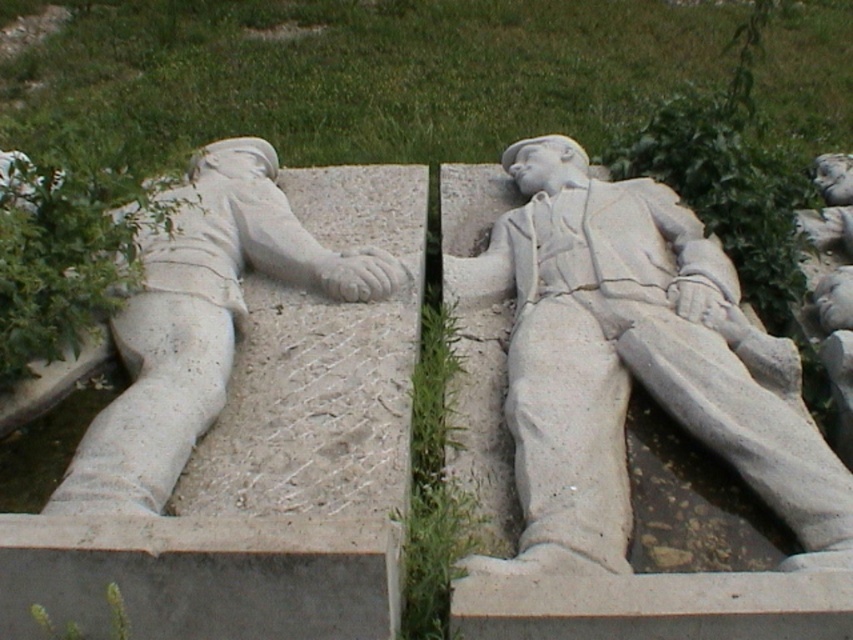
You are standing in front of a memorial with two white stone statues. You want to touch the statue that is closer to you. Which one should you reach for, the white stone statue at center or the white stone statue at left?

Answer: The white stone statue at center is closer to the viewer, so you should reach for the white stone statue at center.

You are standing at the entrance of the memorial and want to place a new flower at the base of the white stone statue at center. Given that the entrance is at point 0,0 and the statue is at coordinates 0.570, 0.744, in which general direction should you walk to reach the statue?

The white stone statue at center is located at coordinates (634, 364). Since the entrance is at (0, 0), you should walk northeast to reach the statue.